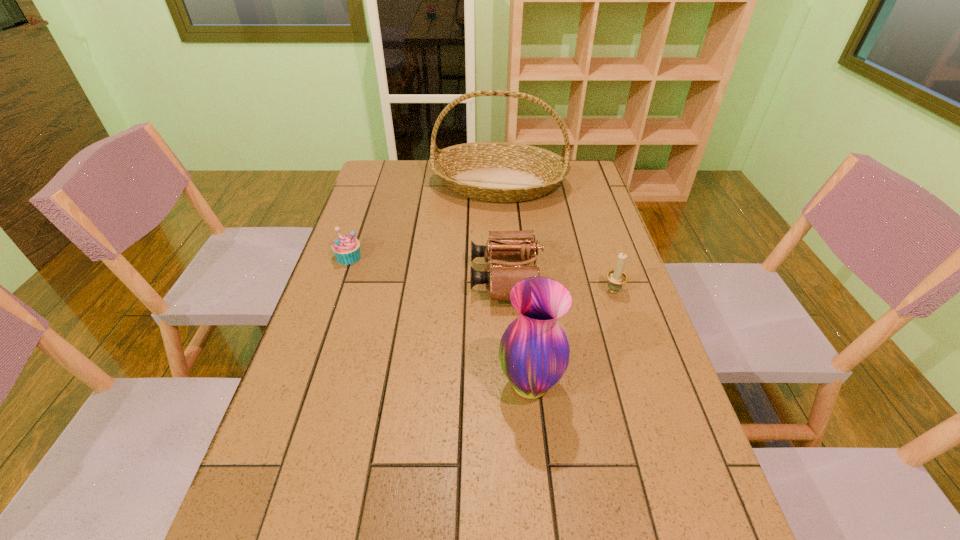
Select which object appears as the second closest to the rightmost object. Please provide its 2D coordinates. Your answer should be formatted as a tuple, i.e. [(x, y)], where the tuple contains the x and y coordinates of a point satisfying the conditions above.

[(534, 351)]

Locate an element on the screen. The height and width of the screenshot is (540, 960). free space that satisfies the following two spatial constraints: 1. through the eyepieces of the binoculars; 2. on the left side of the second tallest object is located at coordinates (513, 385).

Find the location of `vacant area that satisfies the following two spatial constraints: 1. through the eyepieces of the binoculars; 2. on the back side of the vase`. vacant area that satisfies the following two spatial constraints: 1. through the eyepieces of the binoculars; 2. on the back side of the vase is located at coordinates (513, 385).

At what (x,y) coordinates should I click in order to perform the action: click on free space that satisfies the following two spatial constraints: 1. through the eyepieces of the binoculars; 2. on the handle side of the rightmost object. Please return your answer as a coordinate pair (x, y). This screenshot has width=960, height=540. Looking at the image, I should click on (506, 289).

This screenshot has height=540, width=960. Identify the location of blank area in the image that satisfies the following two spatial constraints: 1. on the back side of the farthest object; 2. on the right side of the leftmost object. (374, 184).